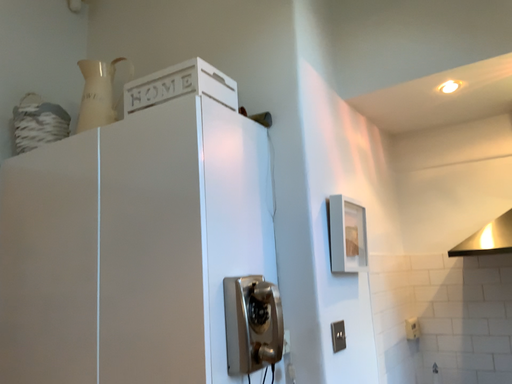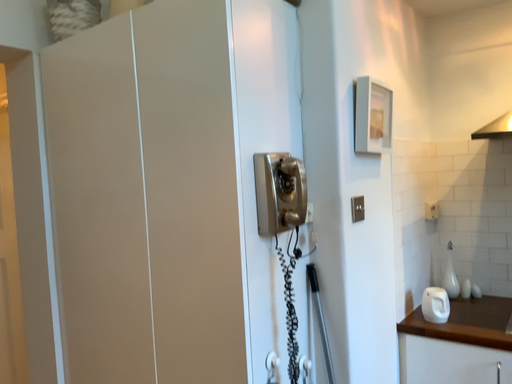
Question: How did the camera likely rotate when shooting the video?

Choices:
 (A) rotated downward
 (B) rotated upward

Answer: (A)